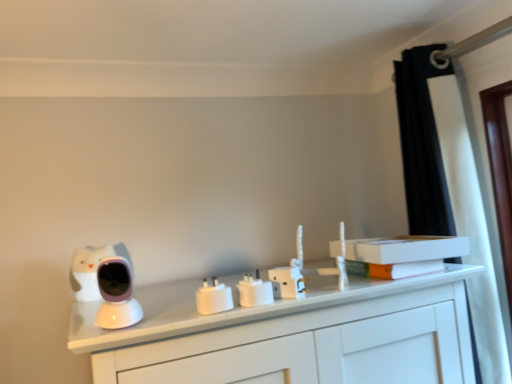
Question: Does black fabric curtain at upper right appear on the left side of orange matte book at upper right, acting as the 1th book starting from the bottom?

Choices:
 (A) yes
 (B) no

Answer: (B)

Question: Is black fabric curtain at upper right positioned before orange matte book at upper right, which is the 2th book in top-to-bottom order?

Choices:
 (A) no
 (B) yes

Answer: (B)

Question: Is black fabric curtain at upper right not inside orange matte book at upper right, which is the 2th book in top-to-bottom order?

Choices:
 (A) no
 (B) yes

Answer: (B)

Question: Could you tell me if black fabric curtain at upper right is turned towards orange matte book at upper right, which is the 2th book in top-to-bottom order?

Choices:
 (A) yes
 (B) no

Answer: (A)

Question: From a real-world perspective, does black fabric curtain at upper right stand above orange matte book at upper right, which is the 2th book in top-to-bottom order?

Choices:
 (A) no
 (B) yes

Answer: (B)

Question: Is white plastic electric outlet at center, the second electric outlet in the right-to-left sequence, wider or thinner than black fabric curtain at upper right?

Choices:
 (A) thin
 (B) wide

Answer: (A)

Question: From the image's perspective, relative to black fabric curtain at upper right, is white plastic electric outlet at center, the second electric outlet from the left, above or below?

Choices:
 (A) above
 (B) below

Answer: (B)

Question: Looking at the image, does white plastic electric outlet at center, the second electric outlet in the right-to-left sequence, seem bigger or smaller compared to black fabric curtain at upper right?

Choices:
 (A) small
 (B) big

Answer: (A)

Question: Is point (269, 289) closer or farther from the camera than point (411, 167)?

Choices:
 (A) farther
 (B) closer

Answer: (B)

Question: Considering their positions, is black fabric curtain at upper right located in front of or behind purple glossy baby monitor at left?

Choices:
 (A) front
 (B) behind

Answer: (B)

Question: Is point (429, 188) positioned closer to the camera than point (90, 294)?

Choices:
 (A) farther
 (B) closer

Answer: (A)

Question: Considering the positions of black fabric curtain at upper right and purple glossy baby monitor at left in the image, is black fabric curtain at upper right taller or shorter than purple glossy baby monitor at left?

Choices:
 (A) tall
 (B) short

Answer: (A)

Question: Is black fabric curtain at upper right wider or thinner than purple glossy baby monitor at left?

Choices:
 (A) thin
 (B) wide

Answer: (B)

Question: Do you think orange matte book at upper right, acting as the 1th book starting from the bottom, is within black fabric curtain at upper right, or outside of it?

Choices:
 (A) outside
 (B) inside

Answer: (A)

Question: Looking at their shapes, would you say orange matte book at upper right, which is the 2th book in top-to-bottom order, is wider or thinner than black fabric curtain at upper right?

Choices:
 (A) thin
 (B) wide

Answer: (A)